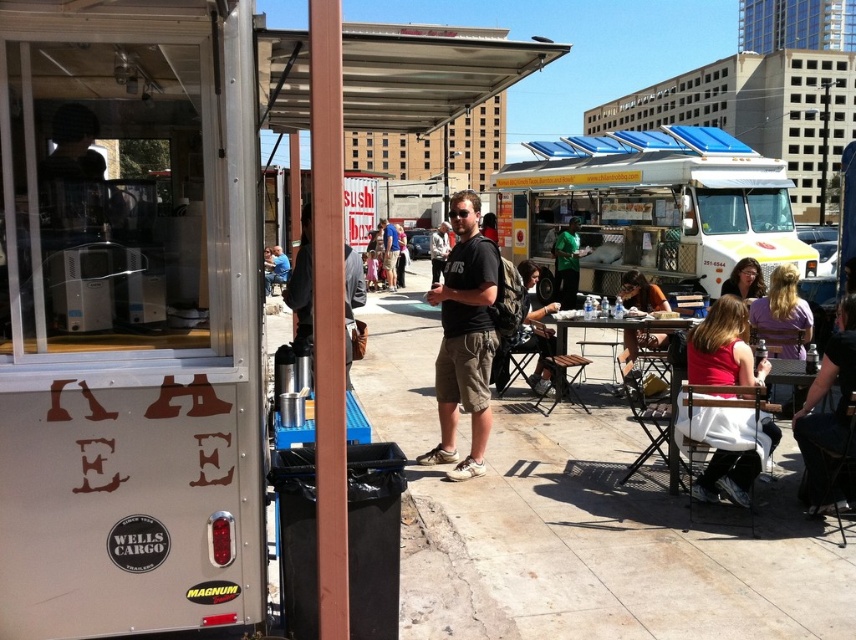
Between camouflage jacket at center and matte black shirt at center, which one appears on the right side from the viewer's perspective?

Positioned to the right is camouflage jacket at center.

Locate an element on the screen. This screenshot has height=640, width=856. camouflage jacket at center is located at coordinates (535, 328).

Measure the distance between camouflage jacket at center and camera.

camouflage jacket at center is 8.08 meters away from camera.

Identify the location of camouflage jacket at center. This screenshot has height=640, width=856. pyautogui.click(x=535, y=328).

Which is below, matte pink shirt at lower right or matte black shirt at center?

matte pink shirt at lower right

Describe the element at coordinates (723, 348) in the screenshot. Image resolution: width=856 pixels, height=640 pixels. I see `matte pink shirt at lower right` at that location.

What are the coordinates of `matte pink shirt at lower right` in the screenshot? It's located at (723, 348).

Is white matte food truck at center thinner than wooden table at center?

Incorrect, white matte food truck at center's width is not less than wooden table at center's.

Can you confirm if white matte food truck at center is taller than wooden table at center?

Correct, white matte food truck at center is much taller as wooden table at center.

This screenshot has height=640, width=856. Describe the element at coordinates (652, 205) in the screenshot. I see `white matte food truck at center` at that location.

Identify the location of white matte food truck at center. (652, 205).